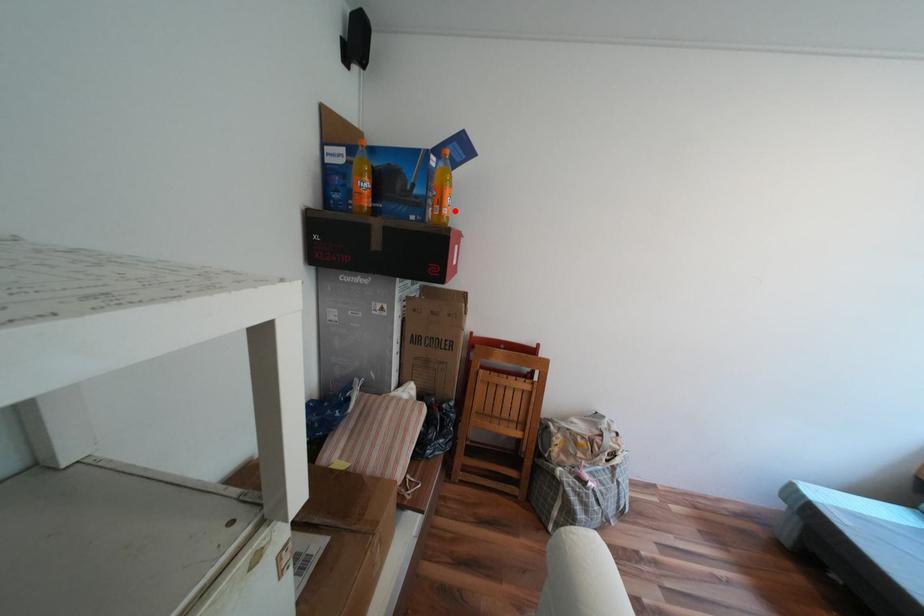
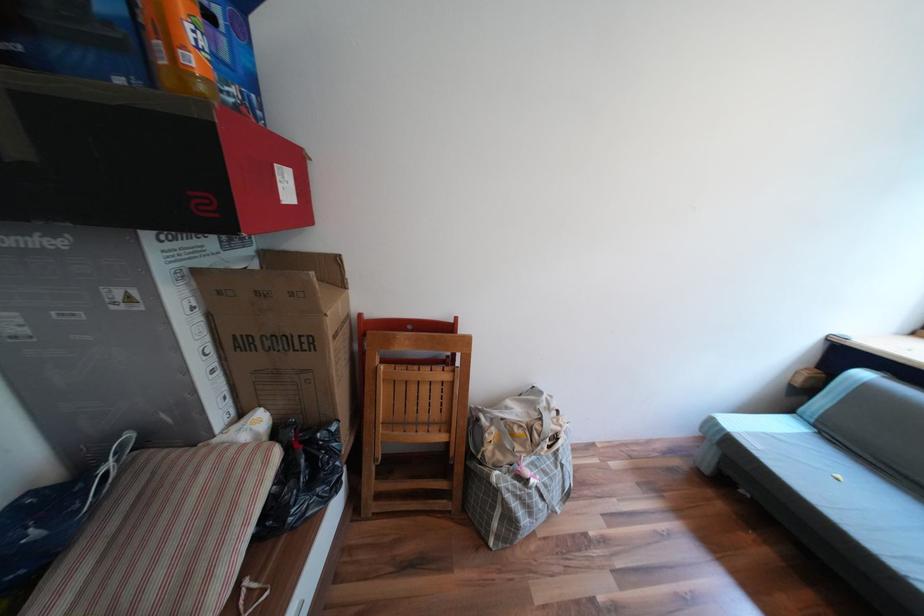
In the second image, find the point that corresponds to the highlighted location in the first image.

(201, 61)